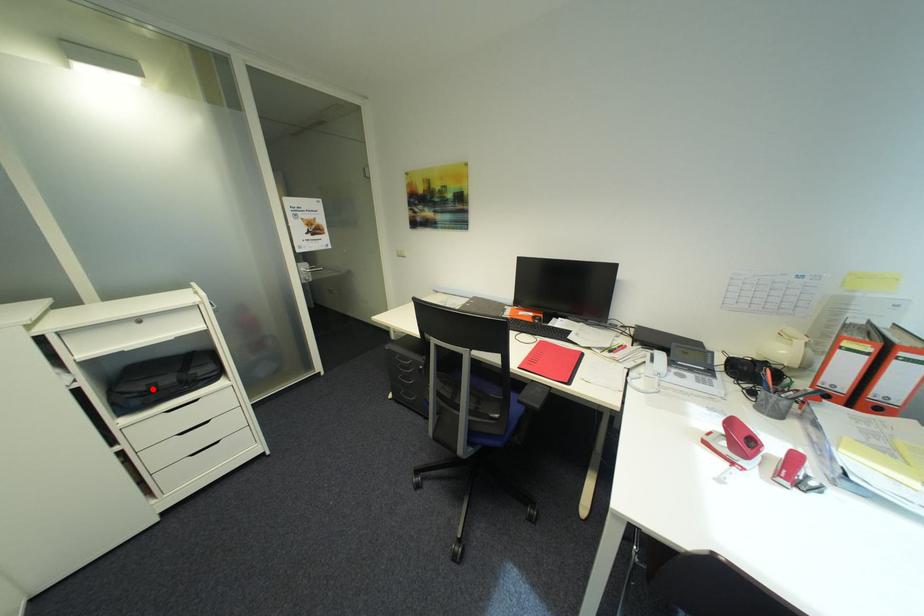
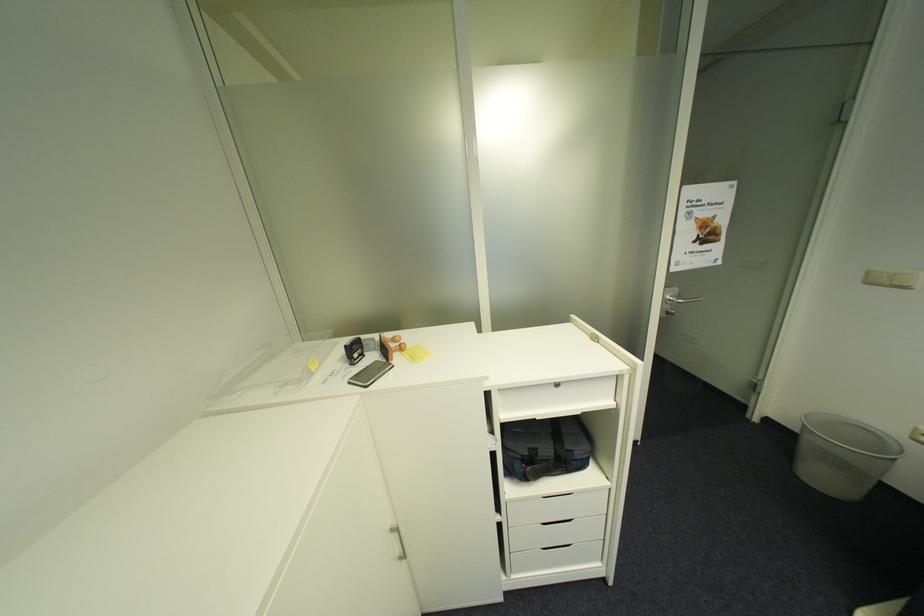
The point at the highlighted location is marked in the first image. Where is the corresponding point in the second image?

(535, 454)